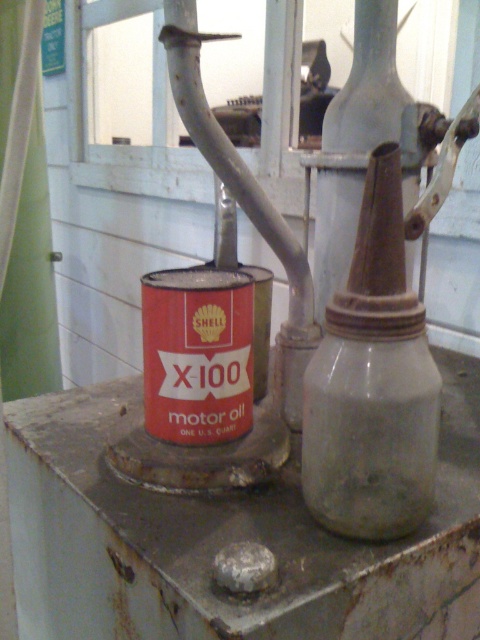
Can you confirm if matte gray oil canister at center is taller than rusty metal oil canister at center?

In fact, matte gray oil canister at center may be shorter than rusty metal oil canister at center.

Measure the distance between matte gray oil canister at center and rusty metal oil canister at center.

matte gray oil canister at center and rusty metal oil canister at center are 8.46 inches apart.

What do you see at coordinates (372, 384) in the screenshot?
I see `matte gray oil canister at center` at bounding box center [372, 384].

Locate an element on the screen. matte gray oil canister at center is located at coordinates (372, 384).